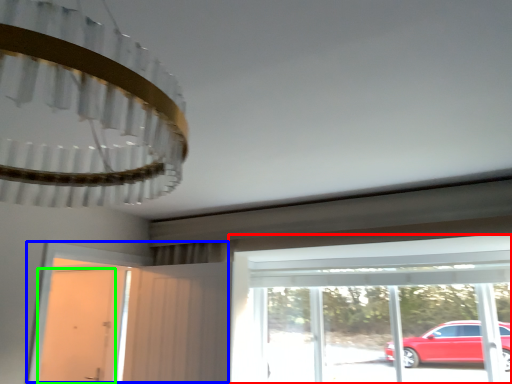
Question: Considering the real-world distances, which object is closest to window (highlighted by a red box)? door (highlighted by a blue box) or door (highlighted by a green box).

Choices:
 (A) door
 (B) door

Answer: (A)